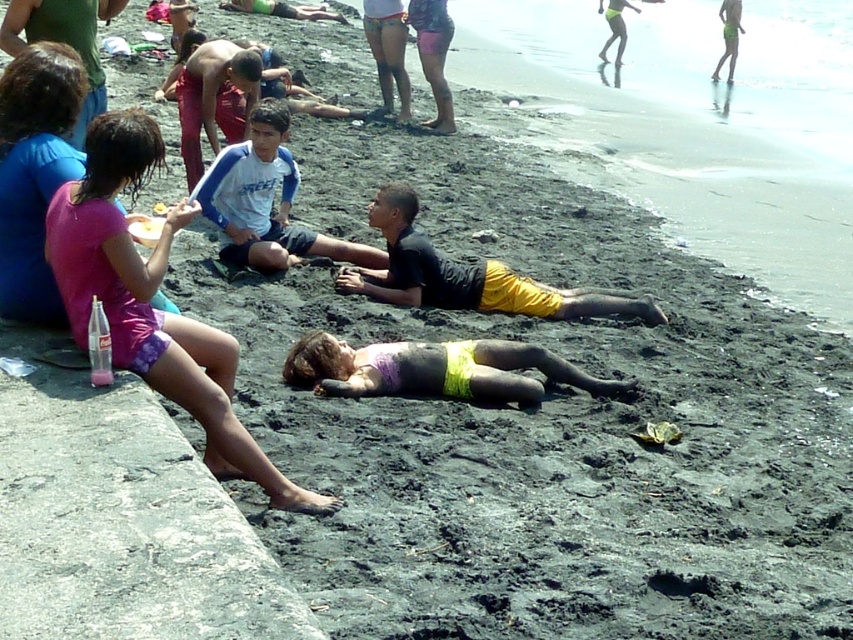
Question: Is matte purple bikini top at center positioned before white cotton shirt at center?

Choices:
 (A) no
 (B) yes

Answer: (B)

Question: Is matte purple bikini top at center positioned before white cotton shirt at center?

Choices:
 (A) no
 (B) yes

Answer: (B)

Question: Which of these objects is positioned closest to the white cotton shirt at center?

Choices:
 (A) matte purple bikini top at center
 (B) purple fabric shorts at lower left

Answer: (A)

Question: Which point appears closest to the camera in this image?

Choices:
 (A) (219, 192)
 (B) (529, 346)
 (C) (105, 188)

Answer: (C)

Question: Does purple fabric shorts at lower left appear over white cotton shirt at center?

Choices:
 (A) yes
 (B) no

Answer: (B)

Question: Based on their relative distances, which object is farther from the purple fabric shorts at lower left?

Choices:
 (A) matte purple bikini top at center
 (B) white cotton shirt at center

Answer: (B)